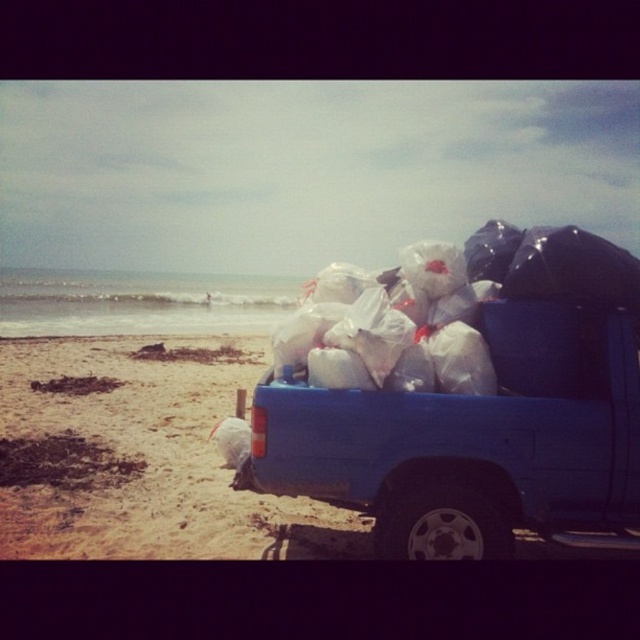
Question: Which point is farther to the camera?

Choices:
 (A) blue matte truck at right
 (B) white plastic bags at center

Answer: (B)

Question: Is blue matte truck at right wider than white plastic bags at center?

Choices:
 (A) yes
 (B) no

Answer: (B)

Question: Which of the following is the farthest from the observer?

Choices:
 (A) (570, 419)
 (B) (595, 280)

Answer: (B)

Question: Does blue matte truck at right lie behind white plastic bags at center?

Choices:
 (A) yes
 (B) no

Answer: (B)

Question: Is blue matte truck at right positioned in front of white plastic bags at center?

Choices:
 (A) yes
 (B) no

Answer: (A)